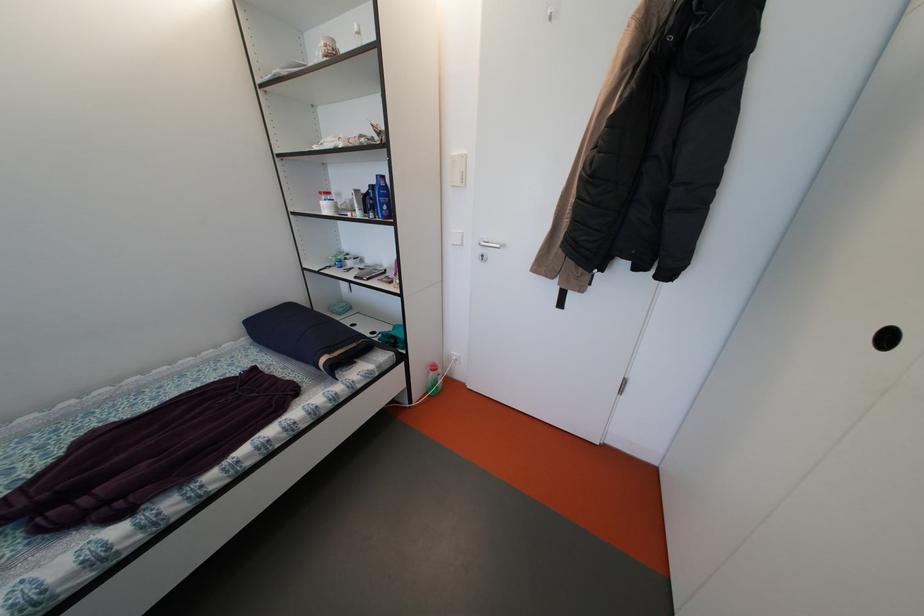
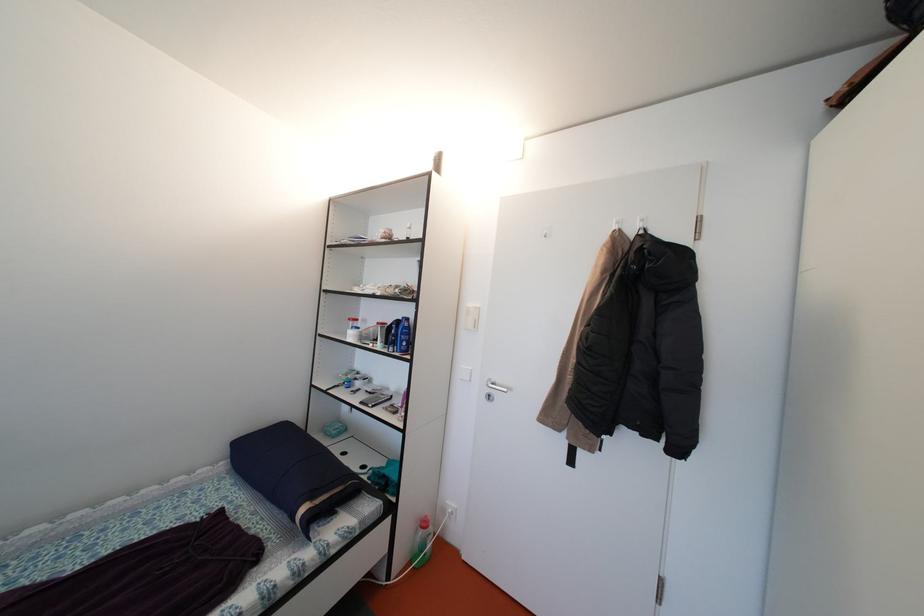
Question: How did the camera likely rotate?

Choices:
 (A) Left
 (B) Right
 (C) Up
 (D) Down

Answer: (C)